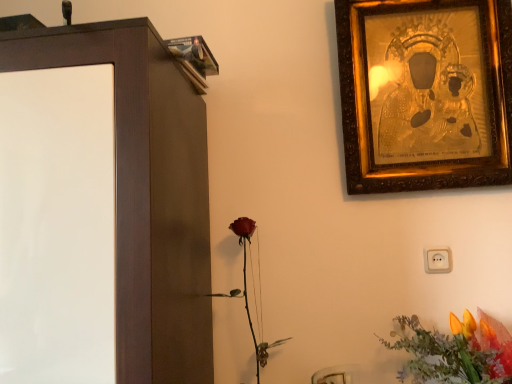
Question: From the image's perspective, is matte brown cabinet at left located above or below vibrant orange petals at lower right?

Choices:
 (A) above
 (B) below

Answer: (A)

Question: Is matte brown cabinet at left taller or shorter than vibrant orange petals at lower right?

Choices:
 (A) tall
 (B) short

Answer: (A)

Question: Estimate the real-world distances between objects in this image. Which object is closer to the gold textured picture frame at upper right?

Choices:
 (A) vibrant orange petals at lower right
 (B) matte brown cabinet at left
 (C) matte red rose at center

Answer: (A)

Question: Which object is the farthest from the vibrant orange petals at lower right?

Choices:
 (A) gold textured picture frame at upper right
 (B) matte red rose at center
 (C) matte brown cabinet at left

Answer: (C)